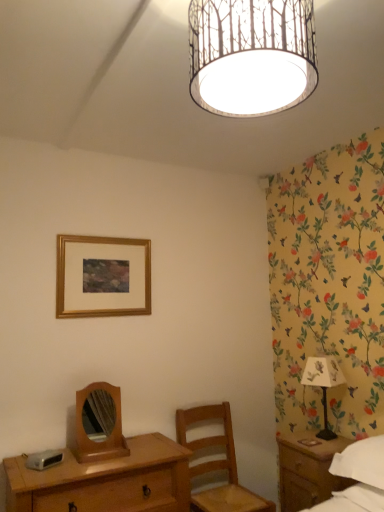
Question: Considering the relative sizes of white fabric lampshade at right and gold wooden picture frame at upper center in the image provided, is white fabric lampshade at right wider than gold wooden picture frame at upper center?

Choices:
 (A) no
 (B) yes

Answer: (B)

Question: Could you tell me if white fabric lampshade at right is turned towards gold wooden picture frame at upper center?

Choices:
 (A) yes
 (B) no

Answer: (B)

Question: Is white fabric lampshade at right turned away from gold wooden picture frame at upper center?

Choices:
 (A) no
 (B) yes

Answer: (A)

Question: Does white fabric lampshade at right come behind gold wooden picture frame at upper center?

Choices:
 (A) no
 (B) yes

Answer: (A)

Question: Considering the relative sizes of white fabric lampshade at right and gold wooden picture frame at upper center in the image provided, is white fabric lampshade at right smaller than gold wooden picture frame at upper center?

Choices:
 (A) no
 (B) yes

Answer: (A)

Question: Is white fabric lampshade at right bigger than gold wooden picture frame at upper center?

Choices:
 (A) yes
 (B) no

Answer: (A)

Question: Considering the relative sizes of white paper with tree pattern at upper center and white cotton bed at lower right in the image provided, is white paper with tree pattern at upper center wider than white cotton bed at lower right?

Choices:
 (A) no
 (B) yes

Answer: (A)

Question: Is white paper with tree pattern at upper center outside white cotton bed at lower right?

Choices:
 (A) no
 (B) yes

Answer: (B)

Question: From a real-world perspective, is white paper with tree pattern at upper center positioned under white cotton bed at lower right based on gravity?

Choices:
 (A) yes
 (B) no

Answer: (B)

Question: Is white paper with tree pattern at upper center positioned behind white cotton bed at lower right?

Choices:
 (A) no
 (B) yes

Answer: (A)

Question: From a real-world perspective, does white paper with tree pattern at upper center stand above white cotton bed at lower right?

Choices:
 (A) yes
 (B) no

Answer: (A)

Question: Does white paper with tree pattern at upper center have a lesser height compared to white cotton bed at lower right?

Choices:
 (A) no
 (B) yes

Answer: (A)

Question: Considering the relative sizes of wooden desk at lower left and wooden chair at center in the image provided, is wooden desk at lower left shorter than wooden chair at center?

Choices:
 (A) yes
 (B) no

Answer: (A)